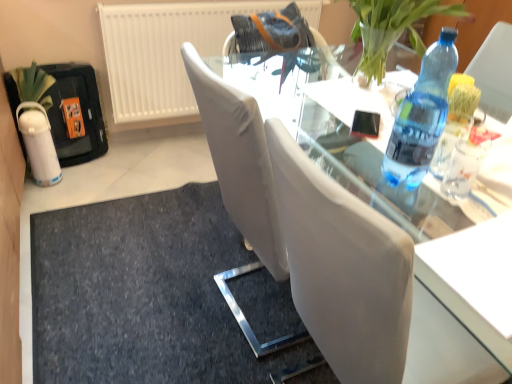
You are a GUI agent. You are given a task and a screenshot of the screen. Output one action in this format:
    pyautogui.click(x=<x>, y=<y>)
    Task: Click on the free spot above dark gray fabric doormat at lower center (from a real-world perspective)
    This screenshot has width=512, height=384.
    Given the screenshot: What is the action you would take?
    pyautogui.click(x=148, y=294)